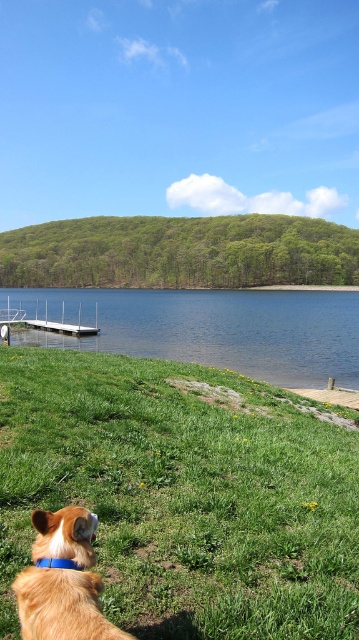
Question: Which point is closer to the camera?

Choices:
 (A) white metallic dock at lower left
 (B) golden fur dog at lower left
 (C) green grassy at lower center

Answer: (B)

Question: Which object is positioned farthest from the golden fur dog at lower left?

Choices:
 (A) white metallic dock at lower left
 (B) blue water at lower center

Answer: (B)

Question: Which of the following is the closest to the observer?

Choices:
 (A) blue water at lower center
 (B) white metallic dock at lower left
 (C) green grassy at lower center

Answer: (C)

Question: Does blue water at lower center have a greater width compared to white metallic dock at lower left?

Choices:
 (A) yes
 (B) no

Answer: (A)

Question: Does golden fur dog at lower left appear over white metallic dock at lower left?

Choices:
 (A) yes
 (B) no

Answer: (B)

Question: Is green grassy at lower center further to the viewer compared to white metallic dock at lower left?

Choices:
 (A) yes
 (B) no

Answer: (B)